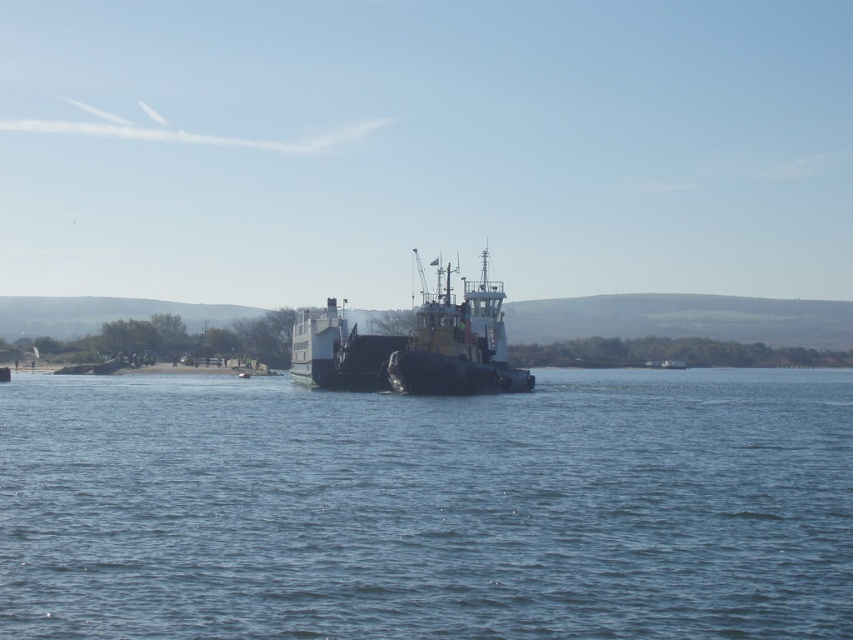
Question: In this image, where is blue water at center located relative to black matte tugboat at center?

Choices:
 (A) right
 (B) left

Answer: (B)

Question: Which point is closer to the camera?

Choices:
 (A) (294, 552)
 (B) (434, 388)

Answer: (A)

Question: Can you confirm if blue water at center is positioned to the right of black matte tugboat at center?

Choices:
 (A) no
 (B) yes

Answer: (A)

Question: Can you confirm if blue water at center is wider than black matte tugboat at center?

Choices:
 (A) yes
 (B) no

Answer: (A)

Question: Which point is farther from the camera taking this photo?

Choices:
 (A) (393, 477)
 (B) (469, 340)

Answer: (B)